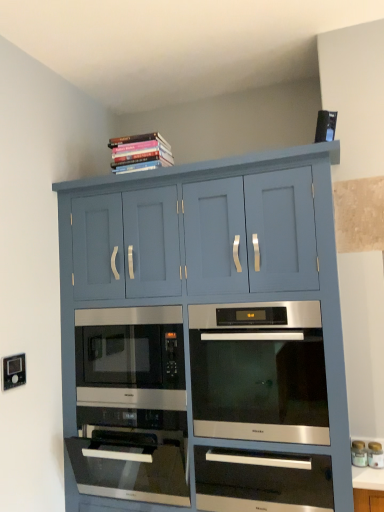
What is the approximate width of matte blue cabinet at upper center?

It is 28.25 inches.

The image size is (384, 512). What do you see at coordinates (259, 372) in the screenshot?
I see `satin silver oven at center` at bounding box center [259, 372].

Image resolution: width=384 pixels, height=512 pixels. Describe the element at coordinates (359, 453) in the screenshot. I see `white glossy jar at lower right, positioned as the 2th appliance in right-to-left order` at that location.

The width and height of the screenshot is (384, 512). Describe the element at coordinates (375, 455) in the screenshot. I see `matte black oven at center, placed as the 2th appliance when sorted from left to right` at that location.

Locate an element on the screen. This screenshot has width=384, height=512. hardcover books at upper center is located at coordinates (139, 152).

From a real-world perspective, which object stands above the other?

sleek stainless steel microwave at center is physically above.

From the picture: Which point is more distant from viewer, (x=377, y=442) or (x=79, y=331)?

Positioned behind is point (x=79, y=331).

Is matte black oven at center, acting as the first appliance starting from the right, smaller than sleek stainless steel microwave at center?

Indeed, matte black oven at center, acting as the first appliance starting from the right, has a smaller size compared to sleek stainless steel microwave at center.

From their relative heights in the image, would you say matte black oven at center, placed as the 2th appliance when sorted from left to right, is taller or shorter than sleek stainless steel microwave at center?

In the image, matte black oven at center, placed as the 2th appliance when sorted from left to right, appears to be shorter than sleek stainless steel microwave at center.

Is sleek stainless steel microwave at center not within matte blue cabinet at upper center?

No, sleek stainless steel microwave at center is not outside of matte blue cabinet at upper center.

Is sleek stainless steel microwave at center in front of matte blue cabinet at upper center?

No, the depth of sleek stainless steel microwave at center is greater than that of matte blue cabinet at upper center.

From a real-world perspective, which is physically above, sleek stainless steel microwave at center or matte blue cabinet at upper center?

sleek stainless steel microwave at center is physically above.

Is matte blue cabinet at upper center smaller than white glossy countertop at lower right?

Actually, matte blue cabinet at upper center might be larger than white glossy countertop at lower right.

Is matte blue cabinet at upper center in front of or behind white glossy countertop at lower right in the image?

In the image, matte blue cabinet at upper center appears in front of white glossy countertop at lower right.

Would you say matte blue cabinet at upper center is to the left or to the right of white glossy countertop at lower right in the picture?

matte blue cabinet at upper center is positioned on white glossy countertop at lower right's left side.

Measure the distance from matte blue cabinet at upper center to white glossy countertop at lower right.

37.15 inches.

Considering the relative sizes of satin silver oven at center and sleek stainless steel microwave at center in the image provided, is satin silver oven at center wider than sleek stainless steel microwave at center?

Yes.

Is satin silver oven at center aimed at sleek stainless steel microwave at center?

No, satin silver oven at center is not aimed at sleek stainless steel microwave at center.

Between satin silver oven at center and sleek stainless steel microwave at center, which one has smaller size?

With smaller size is sleek stainless steel microwave at center.

From the image's perspective, which one is positioned higher, satin silver oven at center or sleek stainless steel microwave at center?

From the image's view, satin silver oven at center is above.

Considering the positions of points (352, 483) and (253, 457), is point (352, 483) farther from camera compared to point (253, 457)?

No, it is in front of (253, 457).

Is white glossy countertop at lower right next to satin silver drawer at center and touching it?

They are not placed beside each other.

Consider the image. Considering the sizes of white glossy countertop at lower right and satin silver drawer at center in the image, is white glossy countertop at lower right bigger or smaller than satin silver drawer at center?

white glossy countertop at lower right is smaller than satin silver drawer at center.

Can you tell me how much white glossy countertop at lower right and satin silver drawer at center differ in facing direction?

0.458 degrees separate the facing orientations of white glossy countertop at lower right and satin silver drawer at center.

From a real-world perspective, does matte black oven at center, placed as the 2th appliance when sorted from left to right, sit lower than white glossy jar at lower right, which is the 1th appliance from left to right?

Correct, in the physical world, matte black oven at center, placed as the 2th appliance when sorted from left to right, is lower than white glossy jar at lower right, which is the 1th appliance from left to right.

Considering the sizes of matte black oven at center, acting as the first appliance starting from the right, and white glossy jar at lower right, positioned as the 2th appliance in right-to-left order, in the image, is matte black oven at center, acting as the first appliance starting from the right, taller or shorter than white glossy jar at lower right, positioned as the 2th appliance in right-to-left order,?

In the image, matte black oven at center, acting as the first appliance starting from the right, appears to be shorter than white glossy jar at lower right, positioned as the 2th appliance in right-to-left order.

Which of these two, matte black oven at center, acting as the first appliance starting from the right, or white glossy jar at lower right, which is the 1th appliance from left to right, is thinner?

Thinner between the two is matte black oven at center, acting as the first appliance starting from the right.

Is white glossy jar at lower right, positioned as the 2th appliance in right-to-left order, located outside satin silver oven at center?

Absolutely, white glossy jar at lower right, positioned as the 2th appliance in right-to-left order, is external to satin silver oven at center.

From a real-world perspective, between white glossy jar at lower right, which is the 1th appliance from left to right, and satin silver oven at center, who is vertically higher?

satin silver oven at center is physically above.

Could you tell me if white glossy jar at lower right, positioned as the 2th appliance in right-to-left order, is turned towards satin silver oven at center?

No.

Where is `the 2nd appliance to the right when counting from the sleek stainless steel microwave at center`? Image resolution: width=384 pixels, height=512 pixels. the 2nd appliance to the right when counting from the sleek stainless steel microwave at center is located at coordinates (375, 455).

This screenshot has width=384, height=512. I want to click on cabinetry that is in front of the sleek stainless steel microwave at center, so click(204, 338).

When comparing their distances from satin silver drawer at center, does sleek stainless steel microwave at center or white plastic electric outlet at lower left seem further?

white plastic electric outlet at lower left is positioned further to the anchor satin silver drawer at center.

Based on their spatial positions, is hardcover books at upper center or white glossy jar at lower right, which is the 1th appliance from left to right, further from satin silver drawer at center?

hardcover books at upper center lies further to satin silver drawer at center than the other object.

From the image, which object appears to be nearer to matte black oven at center, acting as the first appliance starting from the right, white glossy countertop at lower right or matte blue cabinet at upper center?

white glossy countertop at lower right lies closer to matte black oven at center, acting as the first appliance starting from the right, than the other object.

Considering their positions, is satin silver drawer at center positioned further to white glossy jar at lower right, which is the 1th appliance from left to right, than white glossy countertop at lower right?

satin silver drawer at center.

Looking at the image, which one is located further to matte black oven at center, placed as the 2th appliance when sorted from left to right, satin silver oven at center or matte blue cabinet at upper center?

matte blue cabinet at upper center.

Based on their spatial positions, is white glossy jar at lower right, positioned as the 2th appliance in right-to-left order, or sleek stainless steel microwave at center closer to matte blue cabinet at upper center?

Based on the image, sleek stainless steel microwave at center appears to be nearer to matte blue cabinet at upper center.

Estimate the real-world distances between objects in this image. Which object is further from hardcover books at upper center, white glossy countertop at lower right or matte black oven at center, acting as the first appliance starting from the right?

white glossy countertop at lower right is positioned further to the anchor hardcover books at upper center.

Consider the image. Estimate the real-world distances between objects in this image. Which object is closer to white glossy jar at lower right, which is the 1th appliance from left to right, hardcover books at upper center or matte blue cabinet at upper center?

matte blue cabinet at upper center.

Identify the location of drawer between sleek stainless steel microwave at center and white glossy jar at lower right, positioned as the 2th appliance in right-to-left order, from left to right. (261, 481).

You are a GUI agent. You are given a task and a screenshot of the screen. Output one action in this format:
    pyautogui.click(x=<x>, y=<y>)
    Task: Click on the oven between hardcover books at upper center and white glossy jar at lower right, positioned as the 2th appliance in right-to-left order, vertically
    
    Given the screenshot: What is the action you would take?
    pyautogui.click(x=259, y=372)

This screenshot has height=512, width=384. What are the coordinates of `oven situated between matte blue cabinet at upper center and matte black oven at center, placed as the 2th appliance when sorted from left to right, from left to right` in the screenshot? It's located at (259, 372).

Find the location of a particular element. This screenshot has height=512, width=384. microwave oven located between white plastic electric outlet at lower left and matte black oven at center, acting as the first appliance starting from the right, in the left-right direction is located at coordinates [x=130, y=357].